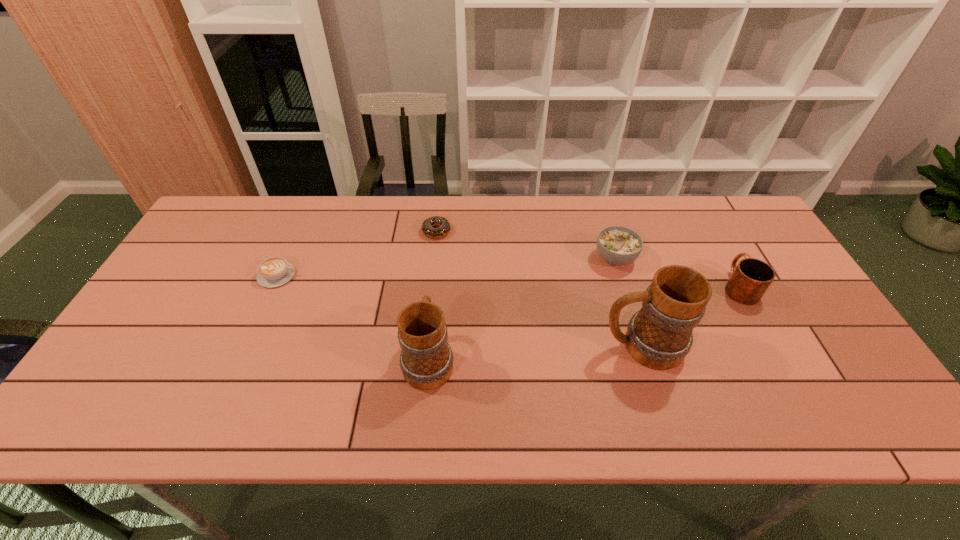
I want to click on the leftmost mug, so click(x=426, y=360).

Identify the location of the fifth shortest object. point(426,360).

Where is `the tallest mug`? This screenshot has width=960, height=540. the tallest mug is located at coordinates (659, 336).

Locate an element on the screen. This screenshot has height=540, width=960. the tallest object is located at coordinates (659, 336).

What are the coordinates of `the farthest object` in the screenshot? It's located at (444, 226).

The image size is (960, 540). I want to click on doughnut, so click(x=444, y=226).

You are a GUI agent. You are given a task and a screenshot of the screen. Output one action in this format:
    pyautogui.click(x=<x>, y=<y>)
    Task: Click on the soup bowl
    
    Given the screenshot: What is the action you would take?
    pyautogui.click(x=617, y=245)

Locate an element on the screen. the rightmost mug is located at coordinates (750, 279).

At what (x,y) coordinates should I click in order to perform the action: click on the farthest mug. Please return your answer as a coordinate pair (x, y). This screenshot has width=960, height=540. Looking at the image, I should click on (750, 279).

Locate an element on the screen. the second shortest object is located at coordinates (275, 271).